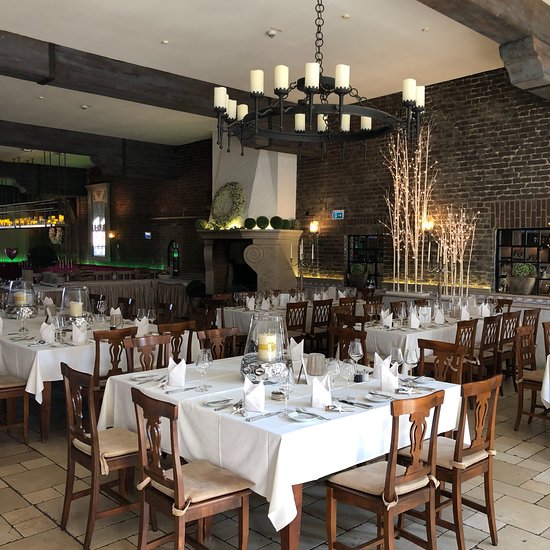
The width and height of the screenshot is (550, 550). In order to click on ceiling beams in this screenshot , I will do `click(31, 174)`, `click(43, 138)`, `click(74, 76)`, `click(485, 20)`.